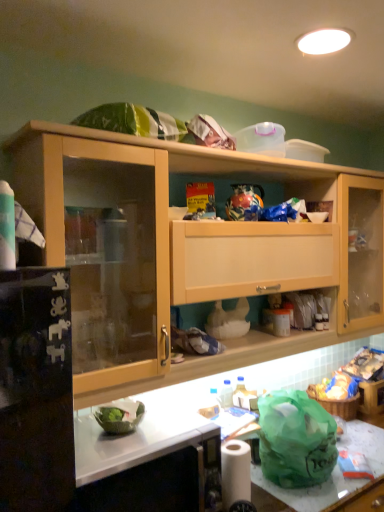
What is the approximate width of white glossy countertop at lower center, positioned as the second counter top in right-to-left order?

white glossy countertop at lower center, positioned as the second counter top in right-to-left order, is 16.71 inches in width.

Image resolution: width=384 pixels, height=512 pixels. What are the coordinates of `white matte toilet paper at lower center` in the screenshot? It's located at (235, 472).

What do you see at coordinates (193, 409) in the screenshot? I see `white marble countertop at lower center` at bounding box center [193, 409].

This screenshot has width=384, height=512. I want to click on white glossy countertop at lower center, placed as the first counter top when sorted from top to bottom, so click(140, 440).

Based on the photo, is white glossy countertop at lower center, positioned as the second counter top in right-to-left order, facing towards white marble countertop at lower center?

No.

Does white glossy countertop at lower center, positioned as the second counter top in right-to-left order, come in front of white marble countertop at lower center?

That is True.

From a real-world perspective, count 2nd counter tops upward from the white marble countertop at lower center and point to it. Please provide its 2D coordinates.

[(140, 440)]

What's the angular difference between white glossy countertop at lower center, arranged as the second counter top when ordered from the bottom, and white marble countertop at lower center's facing directions?

0.992 degrees separate the facing orientations of white glossy countertop at lower center, arranged as the second counter top when ordered from the bottom, and white marble countertop at lower center.

Are green plastic bag at lower right, the second counter top positioned from the top, and white matte toilet paper at lower center located far from each other?

They are positioned close to each other.

Find the location of `counter top that is on the right side of white matte toilet paper at lower center`. counter top that is on the right side of white matte toilet paper at lower center is located at coordinates (309, 490).

Considering the positions of objects green plastic bag at lower right, the 2th counter top in the left-to-right sequence, and white matte toilet paper at lower center in the image provided, who is more to the right, green plastic bag at lower right, the 2th counter top in the left-to-right sequence, or white matte toilet paper at lower center?

Positioned to the right is green plastic bag at lower right, the 2th counter top in the left-to-right sequence.

From the image's perspective, is green plastic bag at lower right, the second counter top positioned from the top, located above or below white matte toilet paper at lower center?

From the image's perspective, green plastic bag at lower right, the second counter top positioned from the top, appears below white matte toilet paper at lower center.

Who is taller, white glossy countertop at lower center, positioned as the second counter top in right-to-left order, or white matte toilet paper at lower center?

With more height is white glossy countertop at lower center, positioned as the second counter top in right-to-left order.

Is white glossy countertop at lower center, arranged as the second counter top when ordered from the bottom, not near white matte toilet paper at lower center?

They are positioned close to each other.

Is white glossy countertop at lower center, placed as the first counter top when sorted from top to bottom, in front of or behind white matte toilet paper at lower center in the image?

white glossy countertop at lower center, placed as the first counter top when sorted from top to bottom, is in front of white matte toilet paper at lower center.

From a real-world perspective, relative to white matte toilet paper at lower center, is white glossy countertop at lower center, positioned as the second counter top in right-to-left order, vertically above or below?

In terms of real-world spatial position, white glossy countertop at lower center, positioned as the second counter top in right-to-left order, is above white matte toilet paper at lower center.

From a real-world perspective, is white matte toilet paper at lower center above or below green plastic bag at lower right, the second counter top positioned from the top?

white matte toilet paper at lower center is situated higher than green plastic bag at lower right, the second counter top positioned from the top, in the real world.

From the image's perspective, is white matte toilet paper at lower center located above green plastic bag at lower right, the 2th counter top in the left-to-right sequence?

Yes, from the image's perspective, white matte toilet paper at lower center is over green plastic bag at lower right, the 2th counter top in the left-to-right sequence.

At what (x,y) coordinates should I click in order to perform the action: click on countertop that appears below the white matte toilet paper at lower center (from a real-world perspective). Please return your answer as a coordinate pair (x, y). This screenshot has width=384, height=512. Looking at the image, I should click on (193, 409).

Which object is thinner, white marble countertop at lower center or white matte toilet paper at lower center?

Thinner between the two is white matte toilet paper at lower center.

In the scene shown: Is white matte toilet paper at lower center surrounded by white marble countertop at lower center?

No, white matte toilet paper at lower center is not inside white marble countertop at lower center.

From a real-world perspective, which is physically above, white glossy countertop at lower center, arranged as the second counter top when ordered from the bottom, or green plastic bag at lower right, which appears as the first counter top when ordered from the bottom?

white glossy countertop at lower center, arranged as the second counter top when ordered from the bottom, is physically above.

Which point is more distant from viewer, (205, 431) or (370, 448)?

The point (370, 448) is behind.

From the image's perspective, which object appears higher, white glossy countertop at lower center, placed as the first counter top when sorted from top to bottom, or green plastic bag at lower right, the 2th counter top in the left-to-right sequence?

From the image's view, white glossy countertop at lower center, placed as the first counter top when sorted from top to bottom, is above.

Which of these two, white glossy countertop at lower center, arranged as the second counter top when ordered from the bottom, or green plastic bag at lower right, which appears as the first counter top when ordered from the bottom, is smaller?

Smaller between the two is green plastic bag at lower right, which appears as the first counter top when ordered from the bottom.

In the scene shown: Visually, is white marble countertop at lower center positioned to the left or to the right of green plastic bag at lower right, which appears as the first counter top when ordered from the bottom?

white marble countertop at lower center is to the right of green plastic bag at lower right, which appears as the first counter top when ordered from the bottom.

Is white marble countertop at lower center aimed at green plastic bag at lower right, positioned as the first counter top in right-to-left order?

No.

Who is taller, white marble countertop at lower center or green plastic bag at lower right, the 2th counter top in the left-to-right sequence?

With more height is white marble countertop at lower center.

Considering the sizes of white marble countertop at lower center and green plastic bag at lower right, which appears as the first counter top when ordered from the bottom, in the image, is white marble countertop at lower center bigger or smaller than green plastic bag at lower right, which appears as the first counter top when ordered from the bottom,?

In the image, white marble countertop at lower center appears to be larger than green plastic bag at lower right, which appears as the first counter top when ordered from the bottom.

Identify the location of countertop that is below the white glossy countertop at lower center, arranged as the second counter top when ordered from the bottom (from the image's perspective). (193, 409).

Where is `counter top that is under the white matte toilet paper at lower center (from a real-world perspective)`? counter top that is under the white matte toilet paper at lower center (from a real-world perspective) is located at coordinates (309, 490).

Which object lies further to the anchor point white marble countertop at lower center, white glossy countertop at lower center, positioned as the second counter top in right-to-left order, or white matte toilet paper at lower center?

The object further to white marble countertop at lower center is white matte toilet paper at lower center.

In the scene shown: From the image, which object appears to be nearer to white marble countertop at lower center, green plastic bag at lower right, the 2th counter top in the left-to-right sequence, or white glossy countertop at lower center, which ranks as the first counter top in left-to-right order?

white glossy countertop at lower center, which ranks as the first counter top in left-to-right order, is positioned closer to the anchor white marble countertop at lower center.

From the image, which object appears to be nearer to white glossy countertop at lower center, positioned as the second counter top in right-to-left order, white matte toilet paper at lower center or green plastic bag at lower right, the second counter top positioned from the top?

Based on the image, white matte toilet paper at lower center appears to be nearer to white glossy countertop at lower center, positioned as the second counter top in right-to-left order.

Considering their positions, is white matte toilet paper at lower center positioned further to green plastic bag at lower right, which appears as the first counter top when ordered from the bottom, than white glossy countertop at lower center, which ranks as the first counter top in left-to-right order?

Among the two, white glossy countertop at lower center, which ranks as the first counter top in left-to-right order, is located further to green plastic bag at lower right, which appears as the first counter top when ordered from the bottom.

Looking at the image, which one is located further to white glossy countertop at lower center, arranged as the second counter top when ordered from the bottom, white matte toilet paper at lower center or white marble countertop at lower center?

Based on the image, white matte toilet paper at lower center appears to be further to white glossy countertop at lower center, arranged as the second counter top when ordered from the bottom.

Considering their positions, is green plastic bag at lower right, positioned as the first counter top in right-to-left order, positioned closer to white matte toilet paper at lower center than white marble countertop at lower center?

Among the two, green plastic bag at lower right, positioned as the first counter top in right-to-left order, is located nearer to white matte toilet paper at lower center.

Based on the photo, looking at the image, which one is located further to white marble countertop at lower center, green plastic bag at lower right, the 2th counter top in the left-to-right sequence, or white matte toilet paper at lower center?

Based on the image, green plastic bag at lower right, the 2th counter top in the left-to-right sequence, appears to be further to white marble countertop at lower center.

Consider the image. Which object lies further to the anchor point white matte toilet paper at lower center, white marble countertop at lower center or white glossy countertop at lower center, placed as the first counter top when sorted from top to bottom?

white marble countertop at lower center lies further to white matte toilet paper at lower center than the other object.

Image resolution: width=384 pixels, height=512 pixels. Identify the location of counter top between white matte toilet paper at lower center and white marble countertop at lower center in the vertical direction. (309, 490).

Where is `counter top between white glossy countertop at lower center, which ranks as the first counter top in left-to-right order, and white marble countertop at lower center, in the horizontal direction`? counter top between white glossy countertop at lower center, which ranks as the first counter top in left-to-right order, and white marble countertop at lower center, in the horizontal direction is located at coordinates (309, 490).

Image resolution: width=384 pixels, height=512 pixels. I want to click on toilet paper located between white glossy countertop at lower center, arranged as the second counter top when ordered from the bottom, and white marble countertop at lower center in the left-right direction, so click(235, 472).

This screenshot has height=512, width=384. What are the coordinates of `toilet paper between white glossy countertop at lower center, arranged as the second counter top when ordered from the bottom, and green plastic bag at lower right, positioned as the first counter top in right-to-left order, from left to right` in the screenshot? It's located at (235, 472).